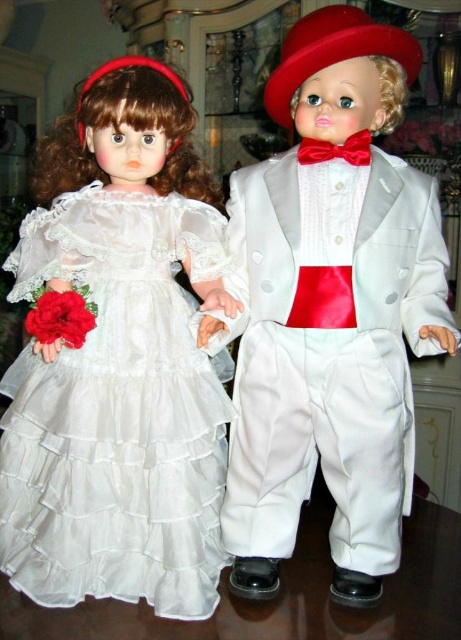
Question: Which object appears farthest from the camera in this image?

Choices:
 (A) matte red hat at upper center
 (B) wooden table at center
 (C) white satin dress at left

Answer: (C)

Question: Is matte red hat at upper center smaller than red satin bow tie at center?

Choices:
 (A) no
 (B) yes

Answer: (A)

Question: Considering the relative positions of red satin bow tie at center and red velvet hat at upper left in the image provided, where is red satin bow tie at center located with respect to red velvet hat at upper left?

Choices:
 (A) above
 (B) below

Answer: (B)

Question: Among these points, which one is farthest from the camera?

Choices:
 (A) (223, 256)
 (B) (315, 154)
 (C) (453, 531)

Answer: (C)

Question: Can you confirm if satin white suit at center is positioned to the right of white satin dress at left?

Choices:
 (A) no
 (B) yes

Answer: (B)

Question: Estimate the real-world distances between objects in this image. Which object is closer to the satin white suit at center?

Choices:
 (A) wooden table at center
 (B) matte red hat at upper center
 (C) red satin bow tie at center
 (D) white satin dress at left

Answer: (D)